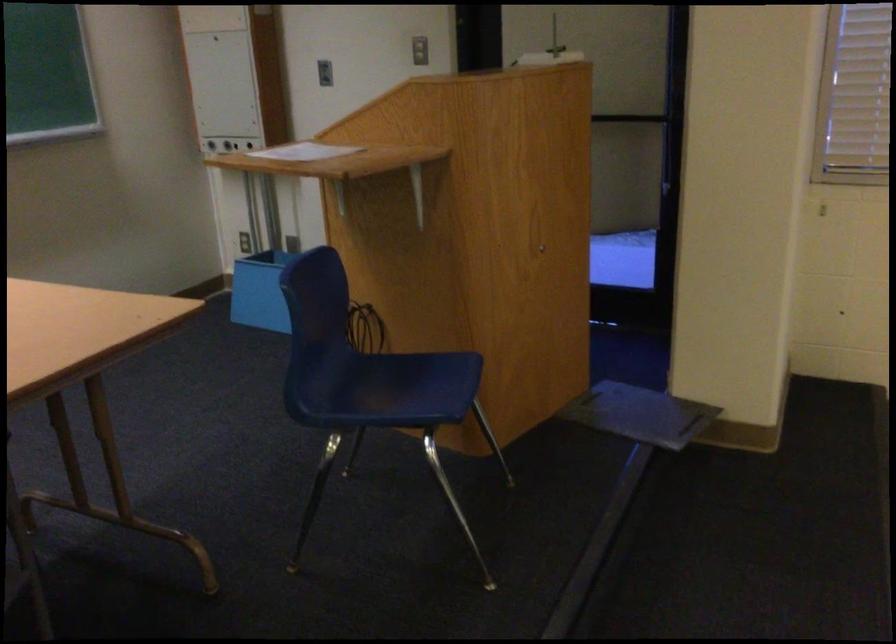
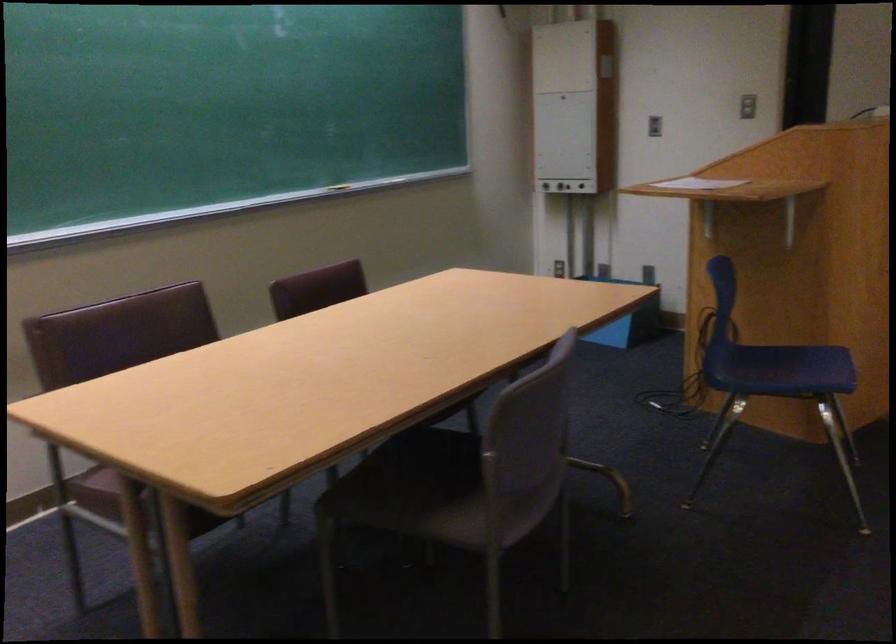
Find the pixel in the second image that matches (324,71) in the first image.

(653, 126)